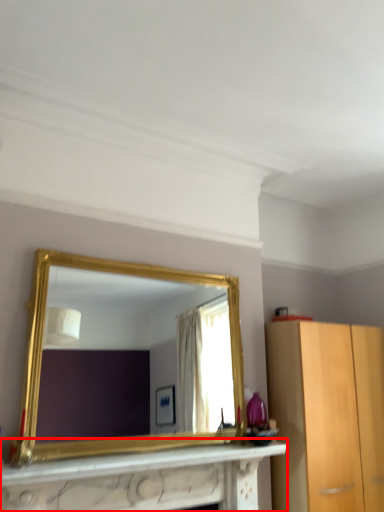
Question: From the image, what is the correct spatial relationship of vanity (annotated by the red box) in relation to mirror?

Choices:
 (A) left
 (B) right

Answer: (A)